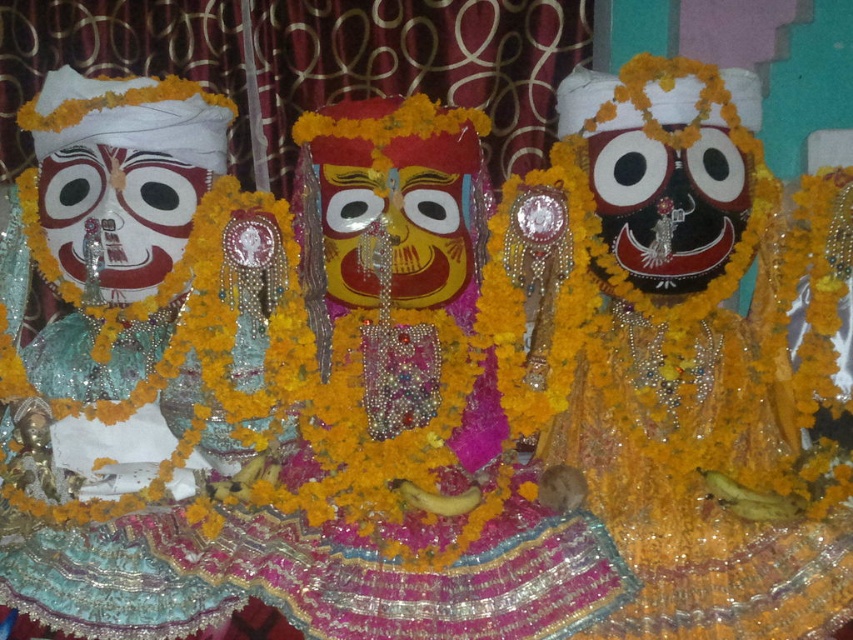
Which of these two, matte green statue at left or yellow matte mask at center, stands taller?

Standing taller between the two is matte green statue at left.

Who is more distant from viewer, (132, 396) or (335, 184)?

Point (132, 396)

Find the location of a particular element. matte green statue at left is located at coordinates (131, 296).

Does matte green statue at left appear over matte black mask at center?

Incorrect, matte green statue at left is not positioned above matte black mask at center.

Is point (239, 342) in front of point (637, 145)?

No.

Locate an element on the screen. This screenshot has width=853, height=640. matte green statue at left is located at coordinates (131, 296).

In the scene shown: Which is below, shiny gold ornament at center or yellow matte mask at center?

Positioned lower is shiny gold ornament at center.

Does shiny gold ornament at center appear on the right side of yellow matte mask at center?

Correct, you'll find shiny gold ornament at center to the right of yellow matte mask at center.

The width and height of the screenshot is (853, 640). What do you see at coordinates (686, 353) in the screenshot?
I see `shiny gold ornament at center` at bounding box center [686, 353].

The width and height of the screenshot is (853, 640). Identify the location of shiny gold ornament at center. [686, 353].